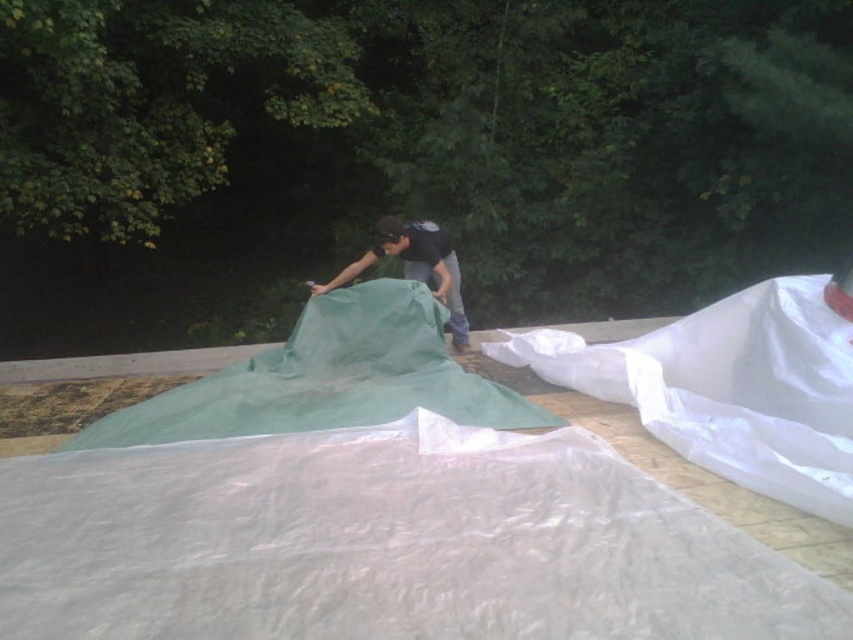
You are trying to locate the transparent plastic sheet at center and the green fabric blanket at center in the image. According to the scene description, which object is positioned to the right of the other?

The transparent plastic sheet at center is to the right of the green fabric blanket at center.

You need to cover a large garden bed with either the transparent plastic sheet at center or the green fabric blanket at center. Which option would provide more coverage area?

The transparent plastic sheet at center has a larger width than the green fabric blanket at center, so it would provide more coverage area.

You are organizing a camping event and need to store two large sheets. The transparent plastic sheet at center and the white translucent sheet at right are both in the storage area. If you have a limited space, which sheet should you prioritize storing first?

The transparent plastic sheet at center should be stored first because it occupies less space than the white translucent sheet at right, making it easier to fit into the limited storage area.